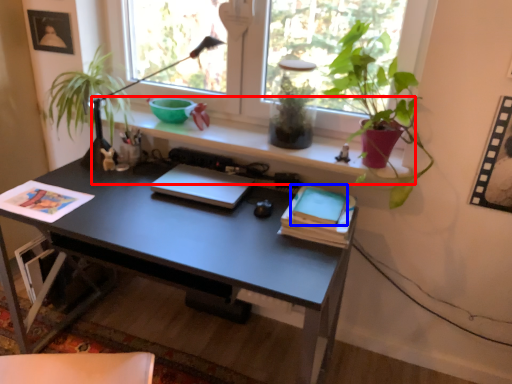
Question: Which of the following is the closest to the observer, window sill (highlighted by a red box) or paperback book (highlighted by a blue box)?

Choices:
 (A) window sill
 (B) paperback book

Answer: (B)